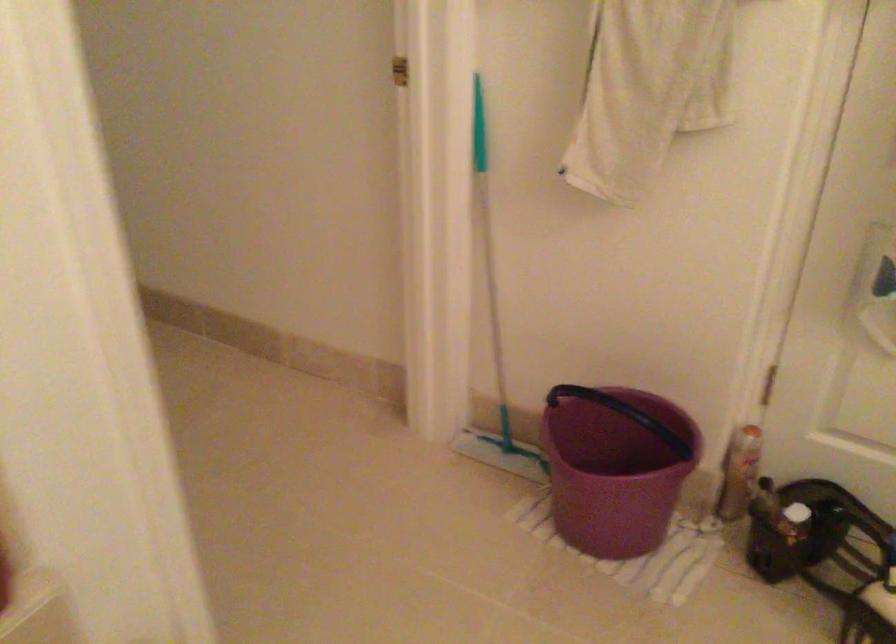
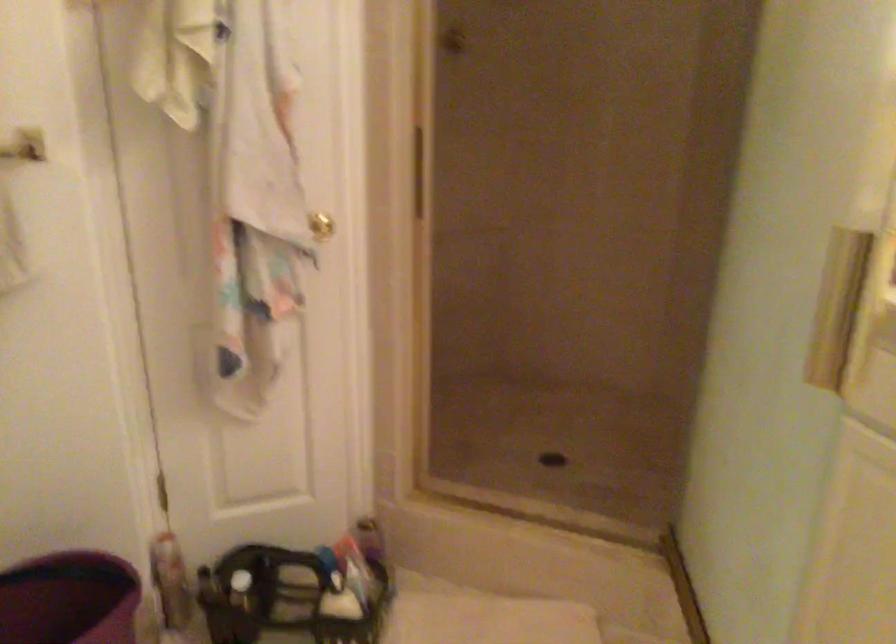
The point at (642, 436) is marked in the first image. Where is the corresponding point in the second image?

(69, 599)